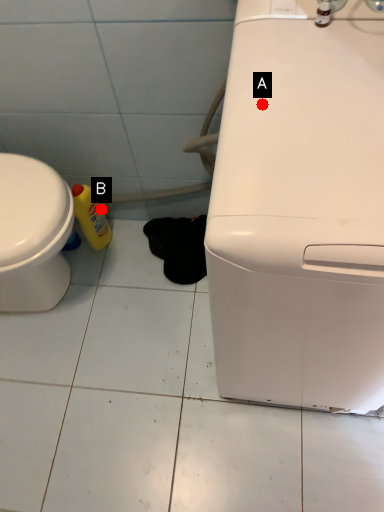
Question: Two points are circled on the image, labeled by A and B beside each circle. Which point is closer to the camera?

Choices:
 (A) A is closer
 (B) B is closer

Answer: (A)